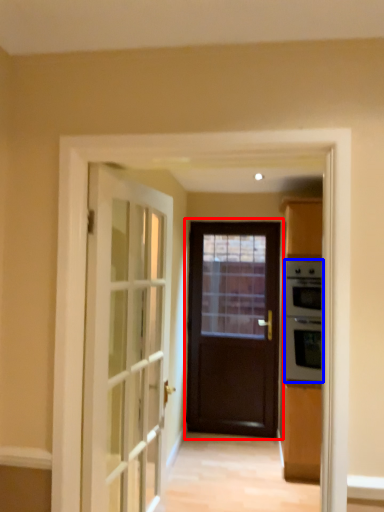
Question: Among these objects, which one is farthest to the camera, door (highlighted by a red box) or appliance (highlighted by a blue box)?

Choices:
 (A) door
 (B) appliance

Answer: (A)